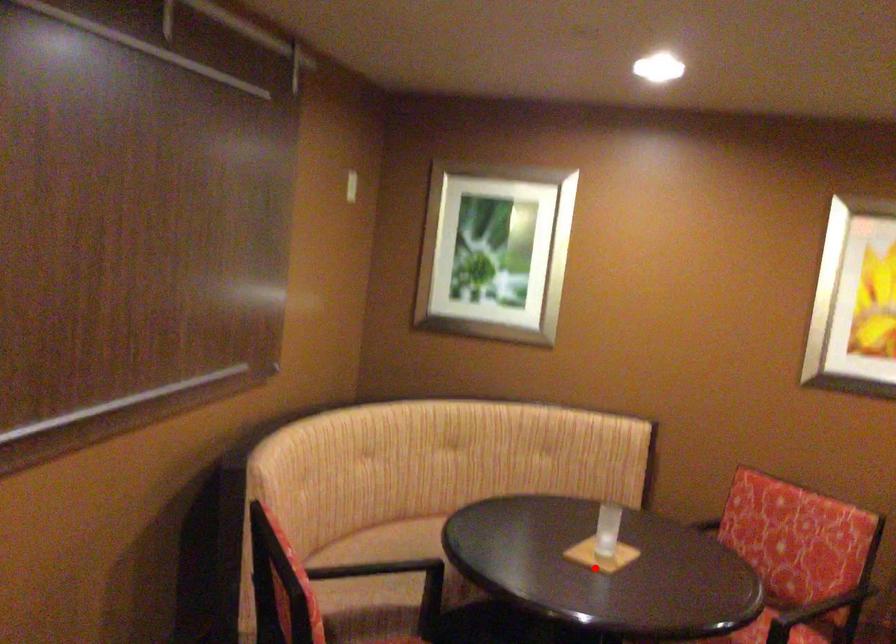
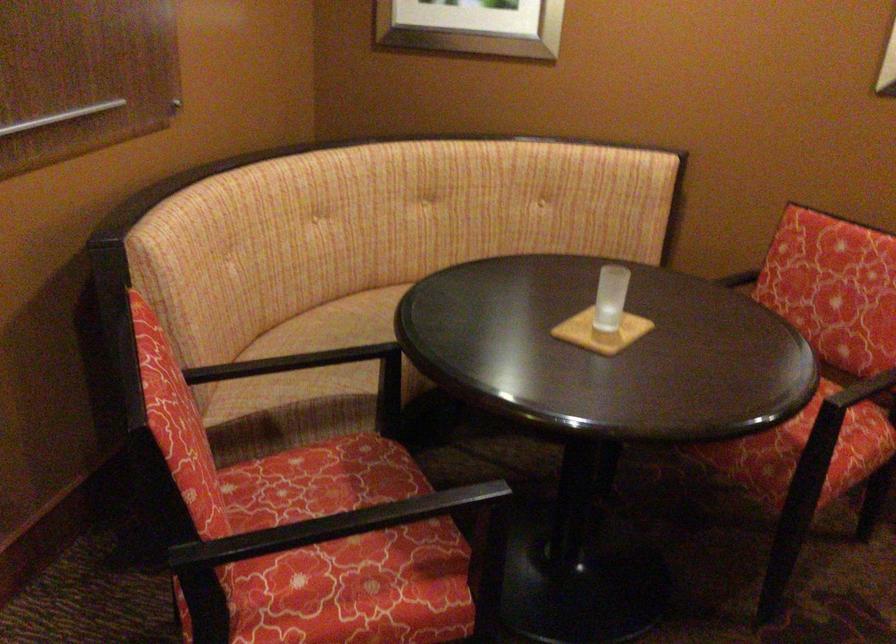
Question: I am providing you with two images of the same scene from different viewpoints. A red point is shown in image1. For the corresponding object point in image2, is it positioned nearer or farther from the camera?

Choices:
 (A) Nearer
 (B) Farther

Answer: (A)